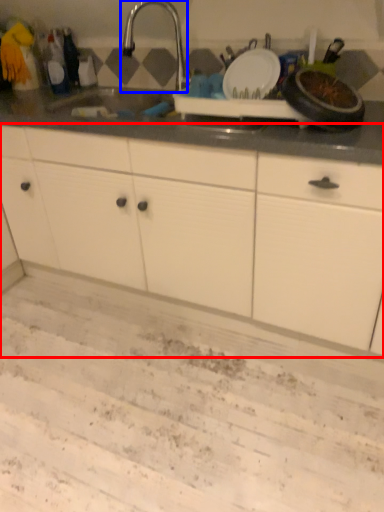
Question: Which point is closer to the camera, cabinetry (highlighted by a red box) or tap (highlighted by a blue box)?

Choices:
 (A) cabinetry
 (B) tap

Answer: (A)